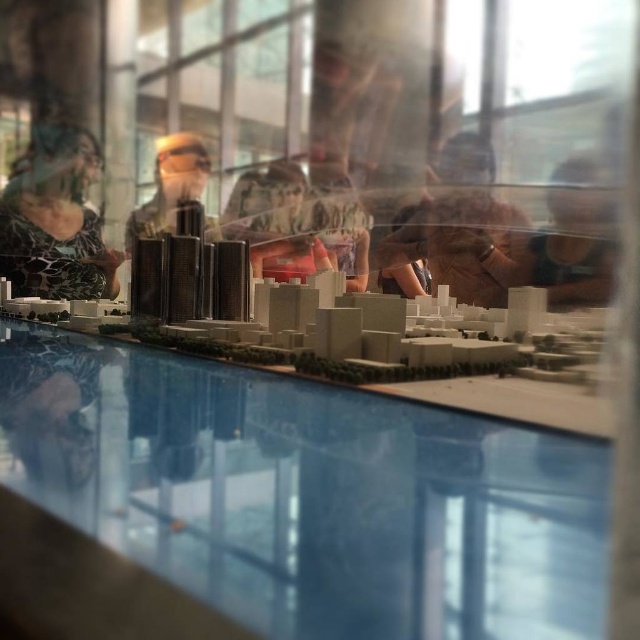
Question: Which point is farther to the camera?

Choices:
 (A) (250, 198)
 (B) (426, 205)
 (C) (20, 186)

Answer: (C)

Question: Is transparent glass table at center smaller than printed fabric shirt at left?

Choices:
 (A) yes
 (B) no

Answer: (A)

Question: Can you confirm if printed fabric shirt at left is positioned below brown leather jacket at center?

Choices:
 (A) no
 (B) yes

Answer: (A)

Question: Among these points, which one is nearest to the camera?

Choices:
 (A) (576, 563)
 (B) (534, 285)
 (C) (28, 172)
 (D) (458, 182)

Answer: (A)

Question: Is transparent glass table at center closer to the viewer compared to smooth brown hair at upper right?

Choices:
 (A) no
 (B) yes

Answer: (B)

Question: Among these objects, which one is farthest from the camera?

Choices:
 (A) smooth beige building at center
 (B) brown leather jacket at center

Answer: (A)